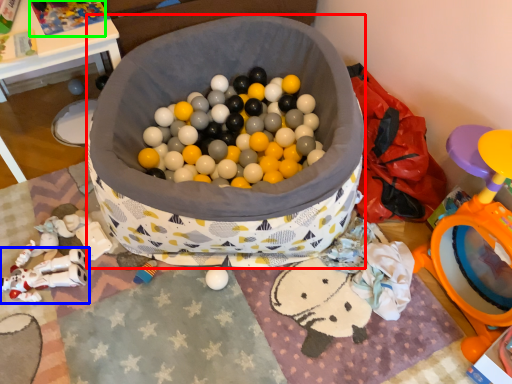
Question: Which is nearer to the laundry basket (highlighted by a red box)? toy (highlighted by a blue box) or toy (highlighted by a green box).

Choices:
 (A) toy
 (B) toy

Answer: (B)